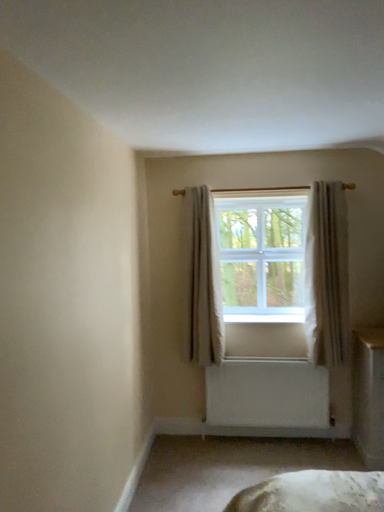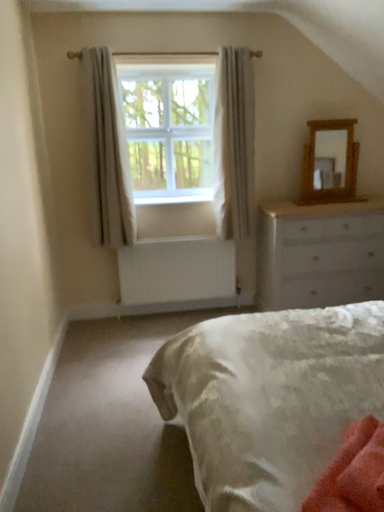
Question: How did the camera likely rotate when shooting the video?

Choices:
 (A) rotated left
 (B) rotated right

Answer: (B)